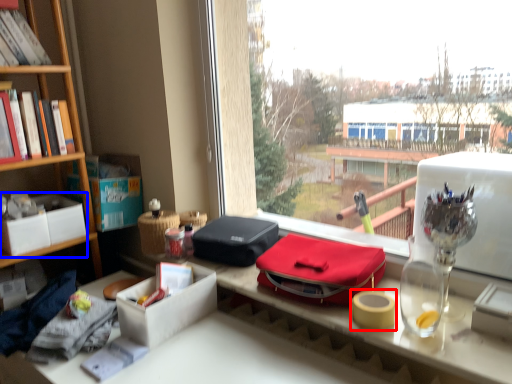
Question: Which object is closer to the camera taking this photo, adhesive tape (highlighted by a red box) or box (highlighted by a blue box)?

Choices:
 (A) adhesive tape
 (B) box

Answer: (A)